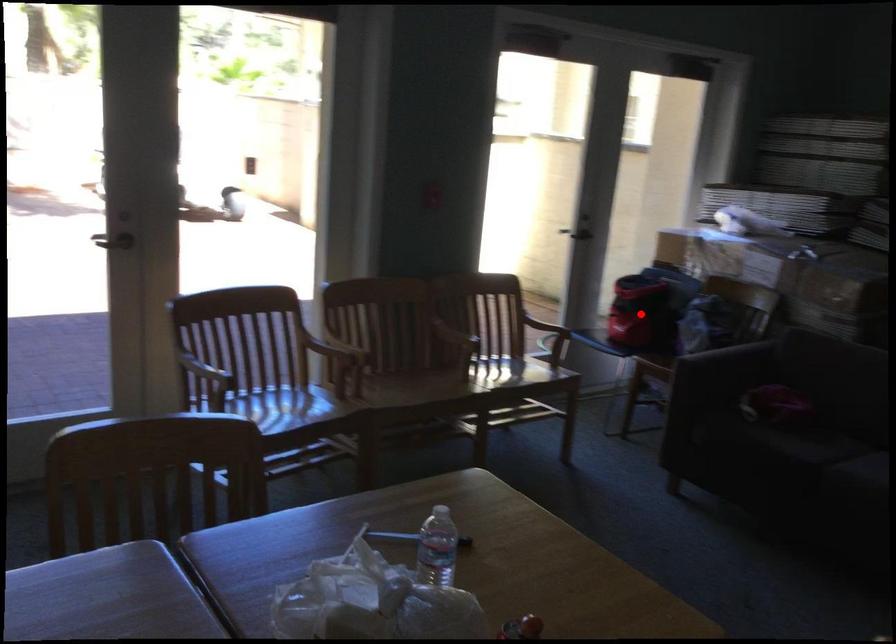
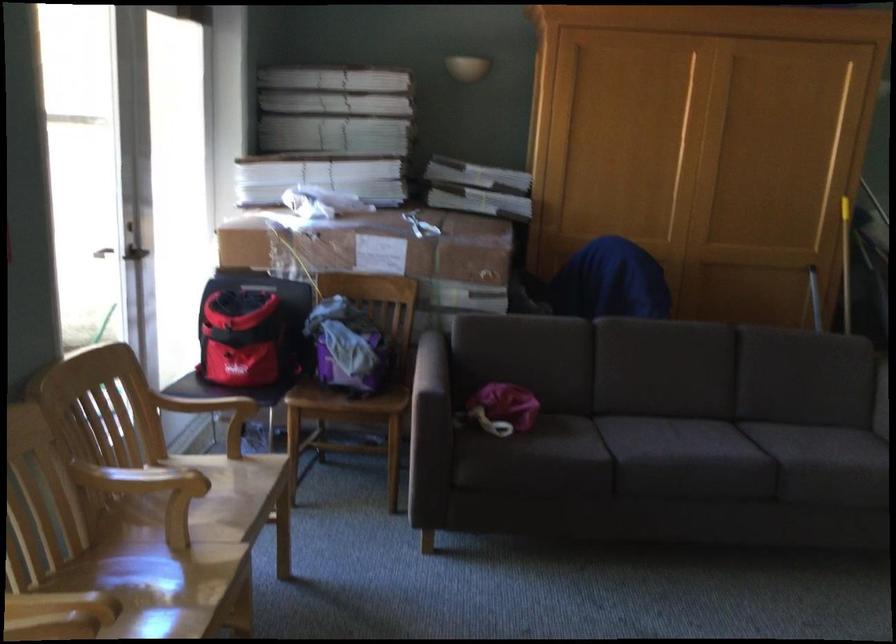
Question: I am providing you with two images of the same scene from different viewpoints. Image1 has a red point marked. In image2, the corresponding 3D location appears at what relative position? Reply with the corresponding letter.

Choices:
 (A) Closer
 (B) Farther

Answer: (A)